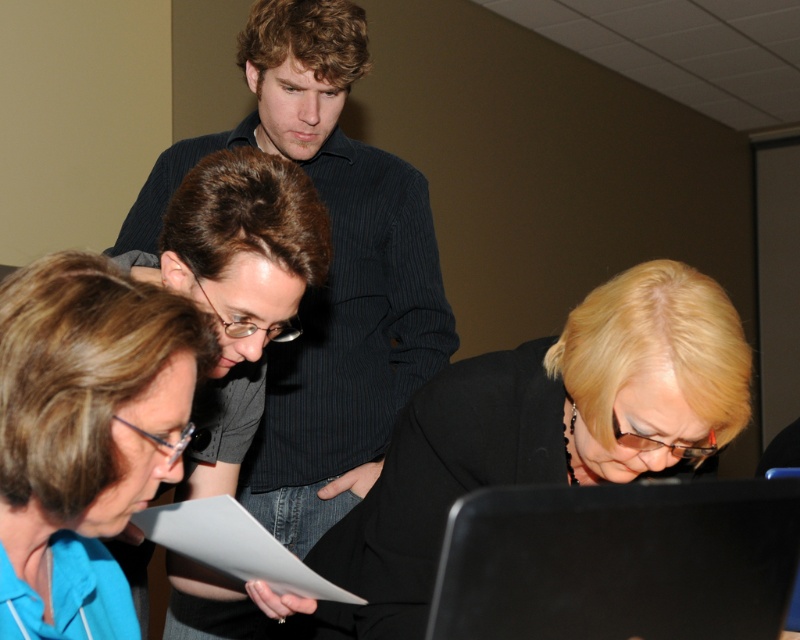
Is the position of dark blue striped shirt at upper center more distant than that of black matte jacket at lower center?

Yes, it is behind black matte jacket at lower center.

Does point (182, 634) come farther from viewer compared to point (524, 470)?

That is True.

Is point (270, 97) positioned behind point (682, 362)?

Yes, point (270, 97) is farther from viewer.

Identify the location of dark blue striped shirt at upper center. This screenshot has height=640, width=800. (329, 272).

Can you confirm if blue fabric shirt at lower left is positioned below white paper at lower center?

Actually, blue fabric shirt at lower left is above white paper at lower center.

Which is below, blue fabric shirt at lower left or white paper at lower center?

white paper at lower center

Find the location of `blue fabric shirt at lower left`. blue fabric shirt at lower left is located at coordinates (84, 413).

Based on the photo, who is more distant from viewer, (x=326, y=364) or (x=200, y=547)?

Positioned behind is point (x=326, y=364).

Describe the element at coordinates (329, 272) in the screenshot. I see `dark blue striped shirt at upper center` at that location.

Does point (170, 163) come closer to viewer compared to point (288, 580)?

No, (170, 163) is behind (288, 580).

Find the location of `dark blue striped shirt at upper center`. dark blue striped shirt at upper center is located at coordinates (329, 272).